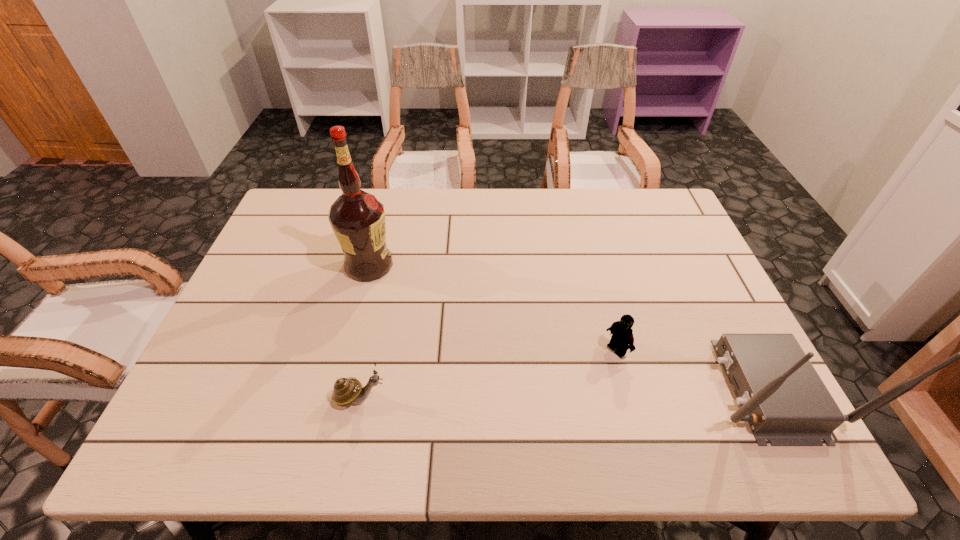
Locate an element on the screen. free space between the snail and the farthest object is located at coordinates (365, 332).

You are a GUI agent. You are given a task and a screenshot of the screen. Output one action in this format:
    pyautogui.click(x=<x>, y=<y>)
    Task: Click on the vacant space that is in between the Lego and the router
    This screenshot has width=960, height=540.
    Given the screenshot: What is the action you would take?
    pyautogui.click(x=692, y=369)

Where is `empty location between the third object from left to right and the snail`? empty location between the third object from left to right and the snail is located at coordinates (489, 373).

You are a GUI agent. You are given a task and a screenshot of the screen. Output one action in this format:
    pyautogui.click(x=<x>, y=<y>)
    Task: Click on the free point between the Lego and the rightmost object
    This screenshot has height=540, width=960.
    Given the screenshot: What is the action you would take?
    pyautogui.click(x=692, y=369)

You are a GUI agent. You are given a task and a screenshot of the screen. Output one action in this format:
    pyautogui.click(x=<x>, y=<y>)
    Task: Click on the free space that is in between the snail and the third object from left to right
    The image size is (960, 540).
    Given the screenshot: What is the action you would take?
    pyautogui.click(x=489, y=373)

Image resolution: width=960 pixels, height=540 pixels. I want to click on empty space that is in between the rightmost object and the snail, so click(564, 393).

Identify which object is the second closest to the rightmost object. Please provide its 2D coordinates. Your answer should be formatted as a tuple, i.e. [(x, y)], where the tuple contains the x and y coordinates of a point satisfying the conditions above.

[(349, 390)]

Identify the location of object identified as the second closest to the Lego. (349, 390).

I want to click on vacant region that satisfies the following two spatial constraints: 1. on the front side of the Lego; 2. on the back of the third shortest object to connect cables, so click(x=628, y=388).

Image resolution: width=960 pixels, height=540 pixels. In order to click on free location that satisfies the following two spatial constraints: 1. on the front side of the snail; 2. on the face of the tallest object in this screenshot , I will do `click(335, 397)`.